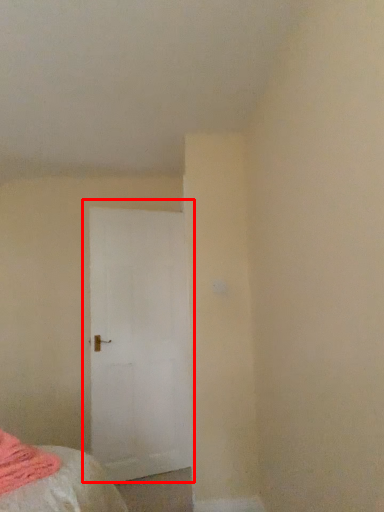
Question: From the image, what is the correct spatial relationship of door (annotated by the red box) in relation to blanket?

Choices:
 (A) right
 (B) left

Answer: (A)